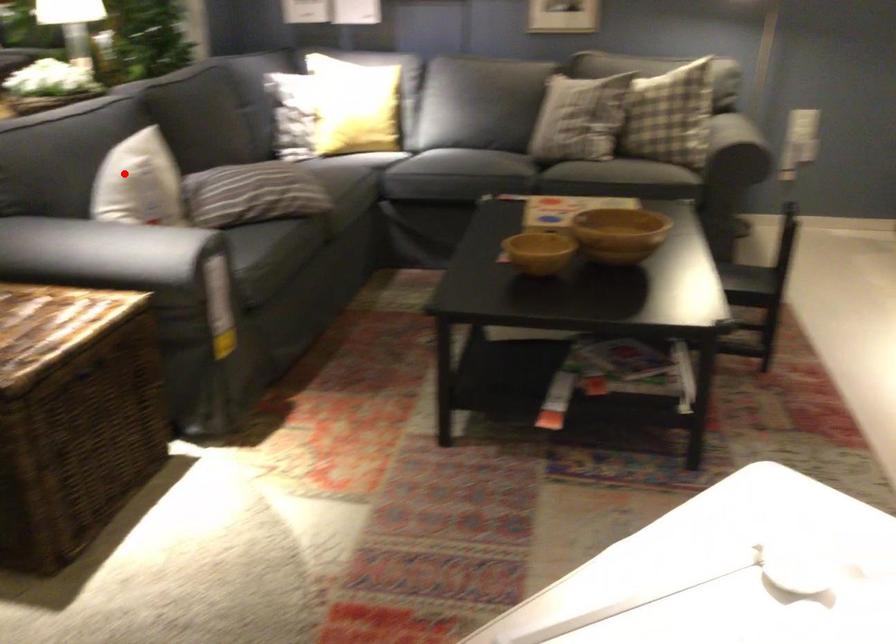
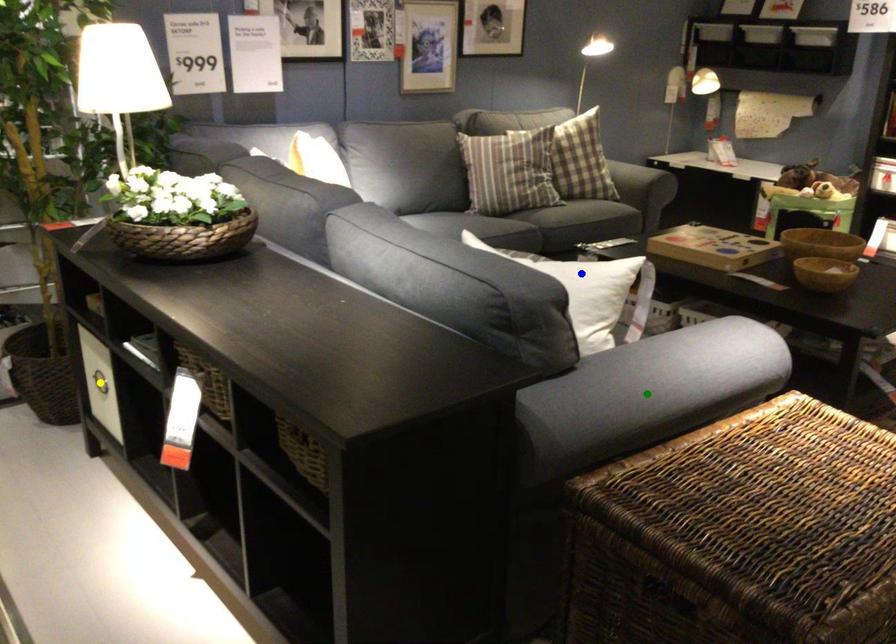
Question: I am providing you with two images of the same scene from different viewpoints. A red point is marked on the first image. You are given multiple points on the second image. Which spot in image 2 lines up with the point in image 1?

Choices:
 (A) yellow point
 (B) green point
 (C) blue point

Answer: (C)